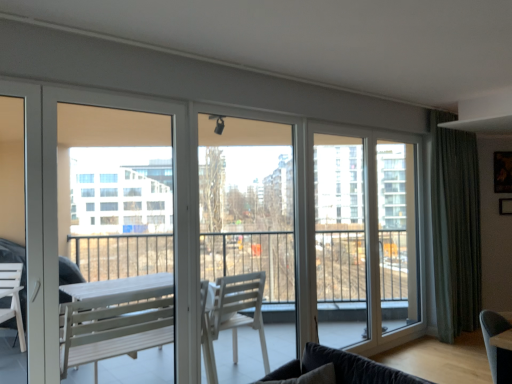
Question: In terms of height, does velvet dark gray studio couch at lower right look taller or shorter compared to white glass screen door at center, the first screen door when ordered from right to left?

Choices:
 (A) tall
 (B) short

Answer: (B)

Question: Looking at their shapes, would you say velvet dark gray studio couch at lower right is wider or thinner than white glass screen door at center, marked as the second screen door in a left-to-right arrangement?

Choices:
 (A) thin
 (B) wide

Answer: (B)

Question: Which object is the farthest from the velvet dark gray studio couch at lower right?

Choices:
 (A) white glass screen door at center, the first screen door when ordered from right to left
 (B) transparent glass window at center
 (C) green textured curtain at right
 (D) white matte screen door at left, arranged as the 1th screen door when viewed from the front

Answer: (C)

Question: Which is nearer to the green textured curtain at right?

Choices:
 (A) velvet dark gray studio couch at lower right
 (B) transparent glass window at center
 (C) white matte screen door at left, the second screen door from the right
 (D) white glass screen door at center, which is the second screen door from front to back

Answer: (D)